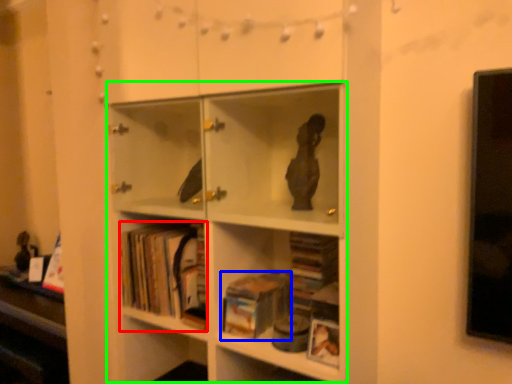
Question: Which is nearer to the book (highlighted by a red box)? book (highlighted by a blue box) or bookcase (highlighted by a green box).

Choices:
 (A) book
 (B) bookcase

Answer: (B)